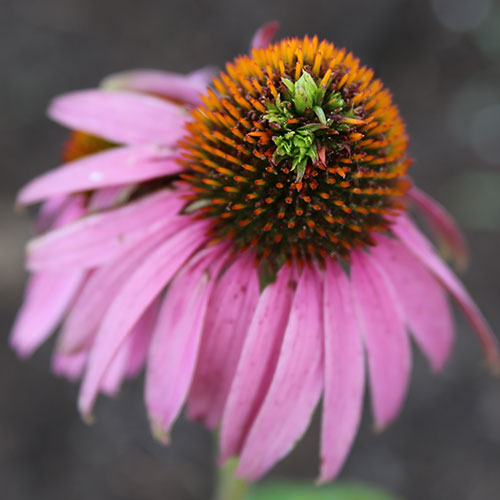
You are a GUI agent. You are given a task and a screenshot of the screen. Output one action in this format:
    pyautogui.click(x=<x>, y=<y>)
    Task: Click on the empty space to right of flower
    This screenshot has height=500, width=500.
    Given the screenshot: What is the action you would take?
    pyautogui.click(x=482, y=228)